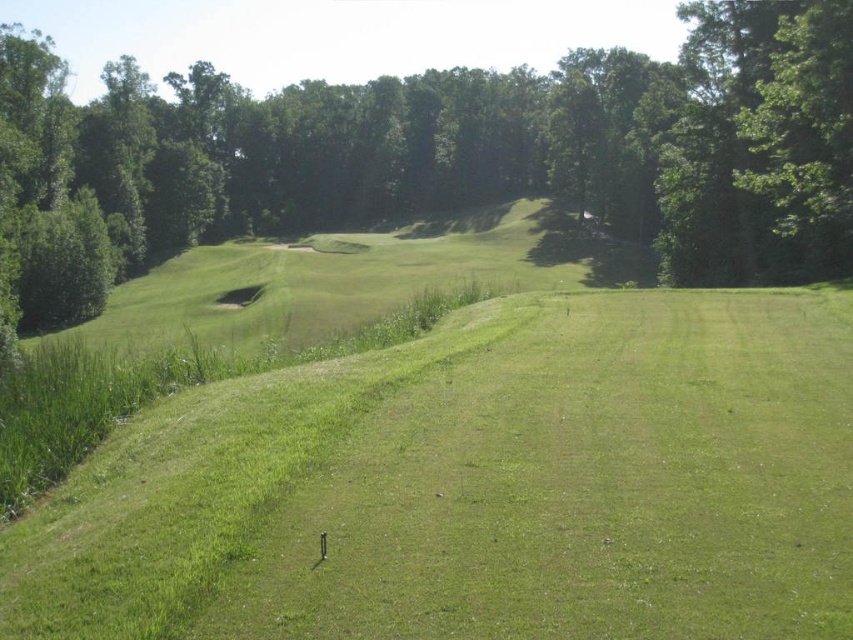
From the picture: You are a golfer standing on the fairway and want to hit the ball towards the green. You notice the green grassy field at center and the green leafy tree at center. Which one is closer to you?

The green grassy field at center is in front of the green leafy tree at center, so it is closer to you.